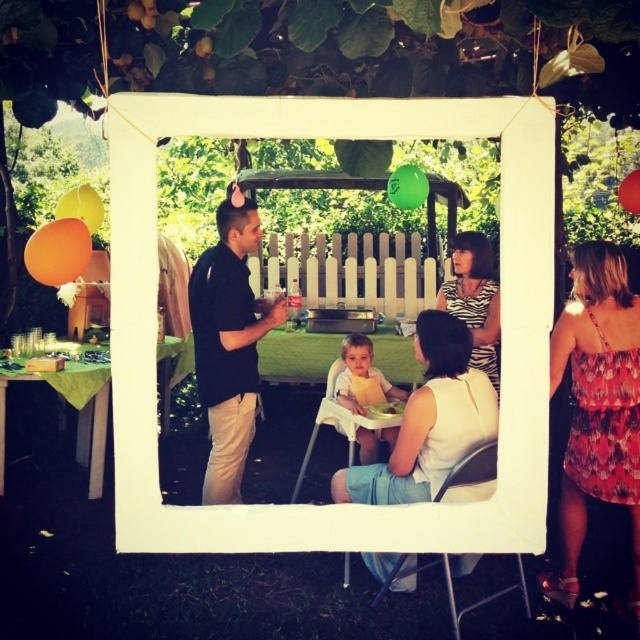
You are a photographer trying to capture a photo of the white fabric dress at center and the yellow rubber balloon at upper left. Which object should you focus on first if you want to ensure both are in focus without moving the camera?

The white fabric dress at center is much taller than the yellow rubber balloon at upper left, so focusing on the white fabric dress at center first would ensure both are in focus since it is closer to the camera.

You are a photographer taking a picture of the scene. The white fabric dress at center and the yellow rubber balloon at upper left are both in the frame. Which object takes up more space in the photo?

The white fabric dress at center takes up more space in the photo because it is larger in size than the yellow rubber balloon at upper left.